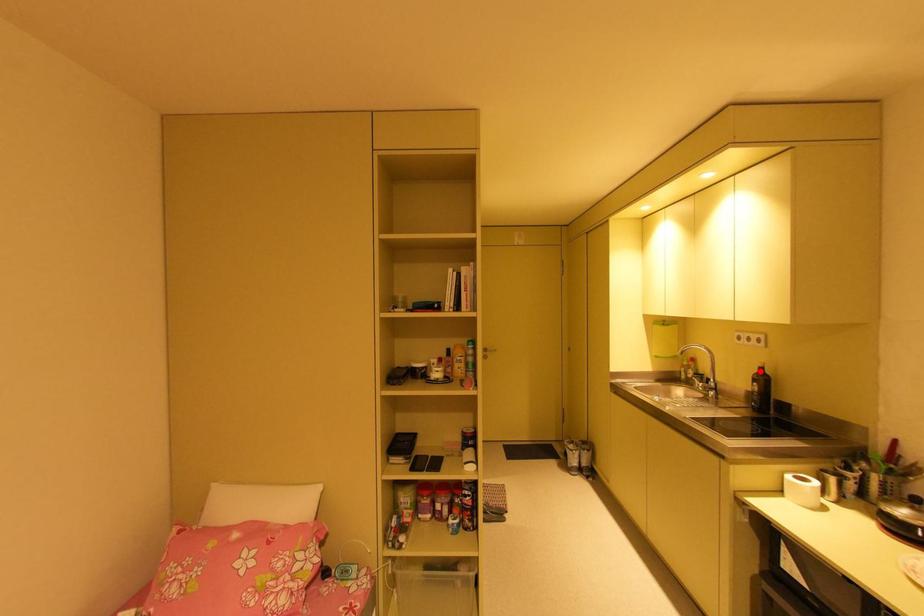
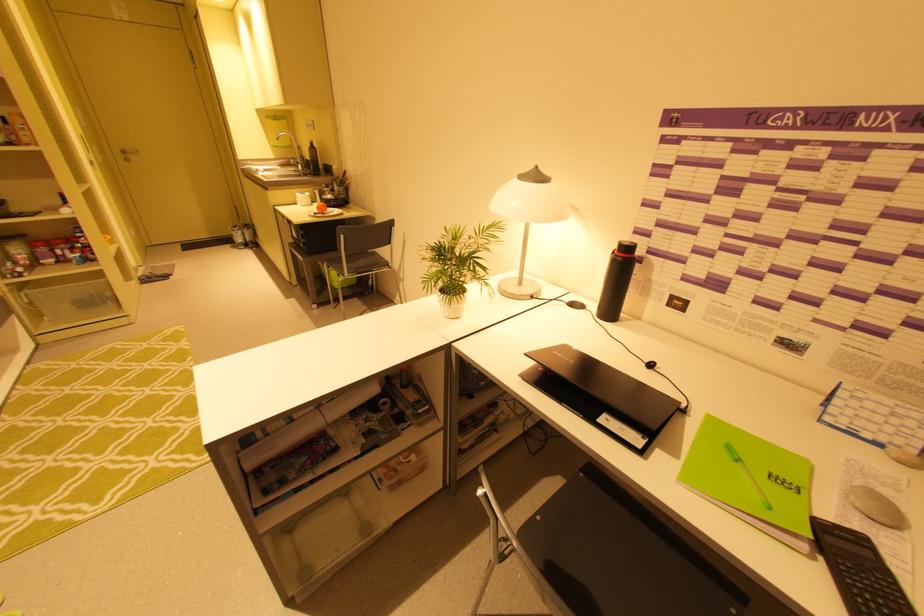
Question: I am providing you with two images of the same scene from different viewpoints. Given a red point in image1, look at the same physical point in image2. Is it:

Choices:
 (A) Closer to the viewpoint
 (B) Farther from the viewpoint

Answer: (A)